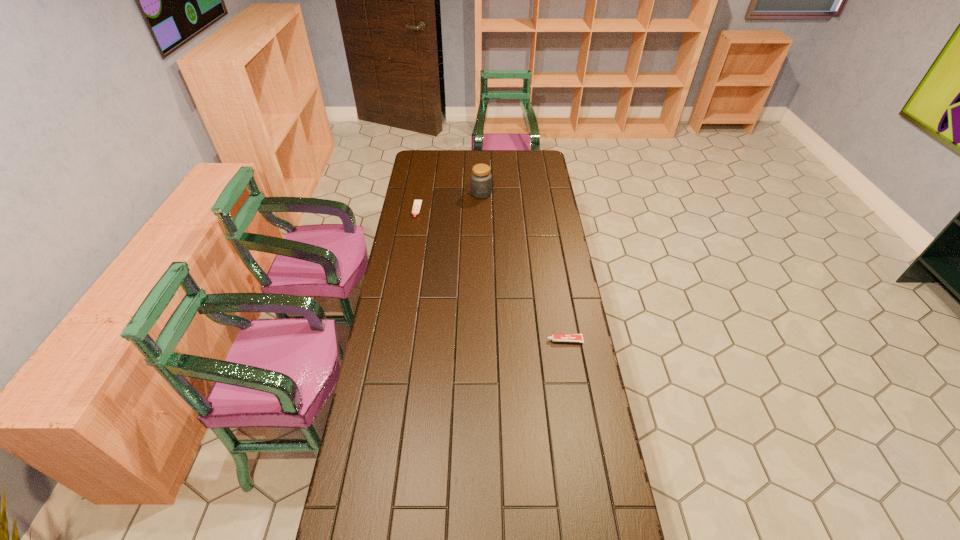
The width and height of the screenshot is (960, 540). In order to click on vacant area that lies between the second farthest object and the second object from right to left in this screenshot , I will do `click(449, 202)`.

Find the location of a particular element. The width and height of the screenshot is (960, 540). empty space that is in between the leftmost object and the jar is located at coordinates (449, 202).

I want to click on free spot between the second object from right to left and the second farthest object, so pyautogui.click(x=449, y=202).

Identify which object is the closest to the tallest object. Please provide its 2D coordinates. Your answer should be formatted as a tuple, i.e. [(x, y)], where the tuple contains the x and y coordinates of a point satisfying the conditions above.

[(417, 203)]

Identify which object is located as the nearest to the nearer toothpaste. Please provide its 2D coordinates. Your answer should be formatted as a tuple, i.e. [(x, y)], where the tuple contains the x and y coordinates of a point satisfying the conditions above.

[(481, 179)]